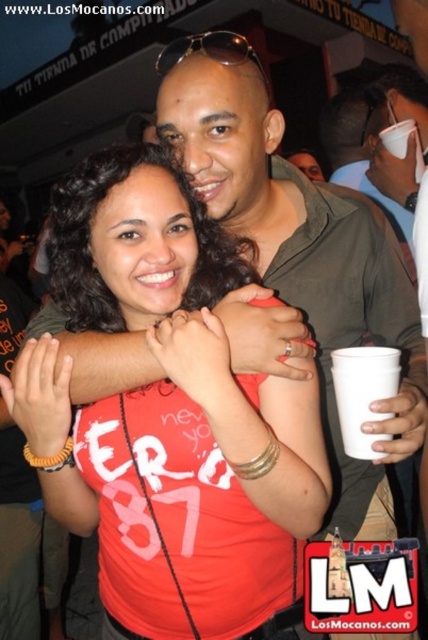
Is the position of matte red shirt at center more distant than that of white plastic cup at right?

No.

Is matte red shirt at center taller than white plastic cup at right?

Correct, matte red shirt at center is much taller as white plastic cup at right.

Between point (222, 513) and point (371, 460), which one is positioned in front?

Point (371, 460) is in front.

Locate an element on the screen. matte red shirt at center is located at coordinates tap(169, 419).